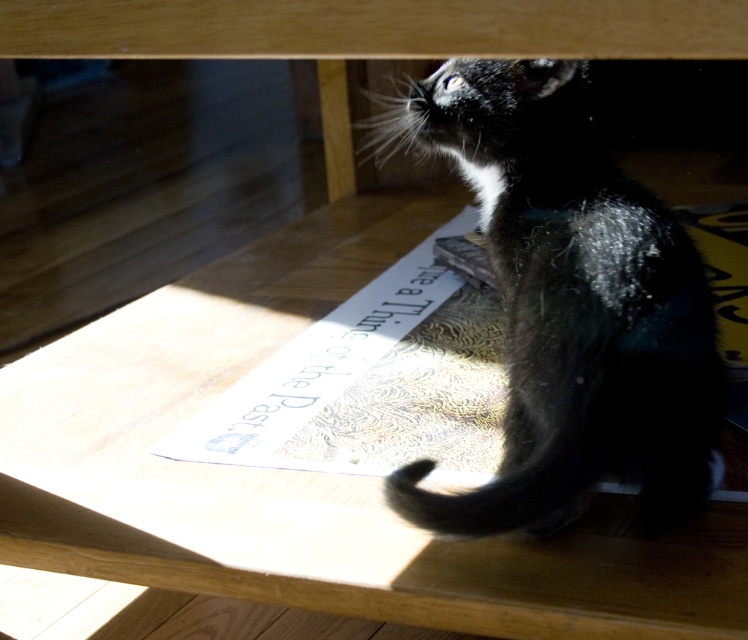
Question: Which of the following is the farthest from the observer?

Choices:
 (A) wooden table at center
 (B) black fur cat at lower right

Answer: (B)

Question: Is wooden table at center positioned before black fur cat at lower right?

Choices:
 (A) yes
 (B) no

Answer: (A)

Question: Which object is closer to the camera taking this photo?

Choices:
 (A) black fur cat at lower right
 (B) wooden table at center

Answer: (B)

Question: Does wooden table at center lie in front of black fur cat at lower right?

Choices:
 (A) yes
 (B) no

Answer: (A)

Question: Can you confirm if wooden table at center is smaller than black fur cat at lower right?

Choices:
 (A) no
 (B) yes

Answer: (A)

Question: Which object is farther from the camera taking this photo?

Choices:
 (A) wooden table at center
 (B) black fur cat at lower right

Answer: (B)